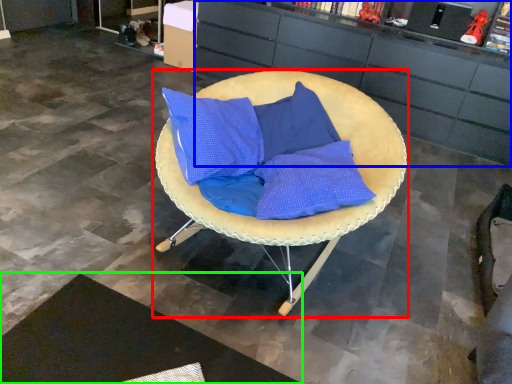
Question: Based on their relative distances, which object is farther from chair (highlighted by a red box)? Choose from cabinetry (highlighted by a blue box) and mat (highlighted by a green box).

Choices:
 (A) cabinetry
 (B) mat

Answer: (A)